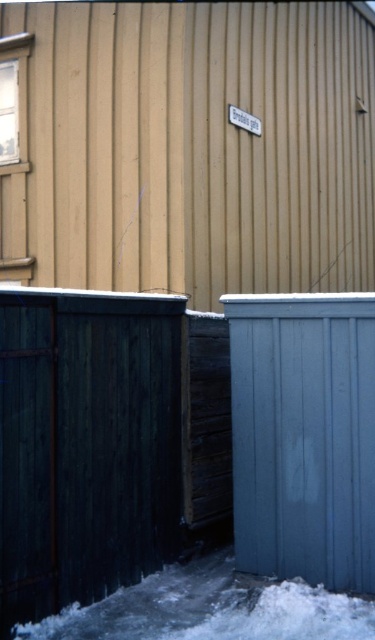
Looking at this image, you are standing at the center of the residential area and want to locate the dark green wooden fence at left. Which direction should you look to find it?

The dark green wooden fence at left is located at point (85, 445), so you should look to the left side to find it.

You are standing in the residential area and see the dark green wooden fence at left and the blue painted wood fence at lower right. Which fence is positioned more to the left side?

The dark green wooden fence at left is positioned more to the left side than the blue painted wood fence at lower right.